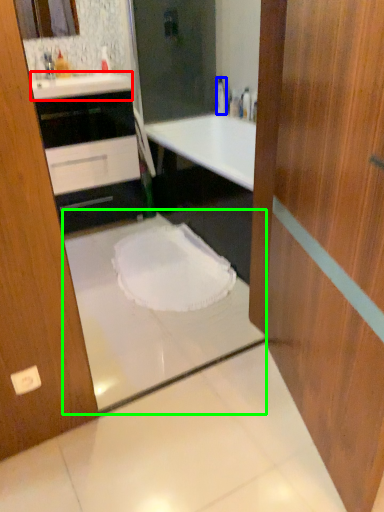
Question: Estimate the real-world distances between objects in this image. Which object is farther from counter top (highlighted by a red box), bottle (highlighted by a blue box) or bath (highlighted by a green box)?

Choices:
 (A) bottle
 (B) bath

Answer: (A)